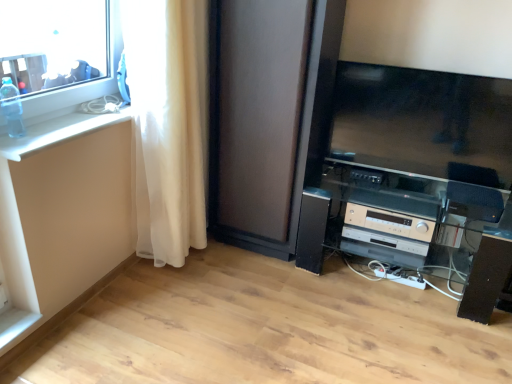
Where is `matte black screen door at center`? The image size is (512, 384). matte black screen door at center is located at coordinates (256, 118).

What do you see at coordinates (389, 228) in the screenshot?
I see `beige plastic stereo at lower right` at bounding box center [389, 228].

Describe the element at coordinates (396, 217) in the screenshot. Image resolution: width=512 pixels, height=384 pixels. I see `satin black entertainment center at lower right` at that location.

Where is `transparent plastic bottle at upper left`? transparent plastic bottle at upper left is located at coordinates (12, 108).

From a real-world perspective, between white sheer curtain at left and satin black entertainment center at lower right, who is vertically lower?

In real-world perspective, satin black entertainment center at lower right is lower.

Between white sheer curtain at left and satin black entertainment center at lower right, which one is positioned behind?

satin black entertainment center at lower right is more distant.

Are white sheer curtain at left and satin black entertainment center at lower right making contact?

No, white sheer curtain at left is not making contact with satin black entertainment center at lower right.

From the picture: Can satin black entertainment center at lower right be found inside white sheer curtain at left?

No, white sheer curtain at left does not contain satin black entertainment center at lower right.

From the image's perspective, which is above, beige plastic stereo at lower right or white glossy counter top at left?

white glossy counter top at left is shown above in the image.

Is white glossy counter top at left a part of beige plastic stereo at lower right?

That's incorrect, white glossy counter top at left is not inside beige plastic stereo at lower right.

Considering the positions of objects beige plastic stereo at lower right and white glossy counter top at left in the image provided, who is more to the right, beige plastic stereo at lower right or white glossy counter top at left?

Positioned to the right is beige plastic stereo at lower right.

Is beige plastic stereo at lower right shorter than white glossy counter top at left?

No, beige plastic stereo at lower right is not shorter than white glossy counter top at left.

Considering the sizes of white sheer curtain at left and matte black screen door at center in the image, is white sheer curtain at left bigger or smaller than matte black screen door at center?

In the image, white sheer curtain at left appears to be smaller than matte black screen door at center.

Locate an element on the screen. curtain in front of the matte black screen door at center is located at coordinates (166, 126).

In the scene shown: Is there a large distance between white sheer curtain at left and matte black screen door at center?

No.

Could you tell me if white sheer curtain at left is facing matte black screen door at center?

No, white sheer curtain at left is not facing towards matte black screen door at center.

Is satin black entertainment center at lower right surrounding matte black screen door at center?

That's incorrect, matte black screen door at center is not inside satin black entertainment center at lower right.

From a real-world perspective, who is located higher, satin black entertainment center at lower right or matte black screen door at center?

matte black screen door at center.

Is point (404, 220) positioned before point (238, 19)?

No, (404, 220) is behind (238, 19).

How different are the orientations of satin black entertainment center at lower right and matte black screen door at center in degrees?

The angle between the facing direction of satin black entertainment center at lower right and the facing direction of matte black screen door at center is 1.26 degrees.

Which object is wider, white sheer curtain at left or white glossy counter top at left?

white sheer curtain at left.

Can you confirm if white sheer curtain at left is positioned to the right of white glossy counter top at left?

Yes.

From a real-world perspective, which is physically below, white sheer curtain at left or white glossy counter top at left?

In real-world perspective, white sheer curtain at left is lower.

Is white sheer curtain at left facing away from white glossy counter top at left?

white sheer curtain at left is not turned away from white glossy counter top at left.

Does matte black screen door at center appear on the right side of transparent plastic bottle at upper left?

Indeed, matte black screen door at center is positioned on the right side of transparent plastic bottle at upper left.

How many degrees apart are the facing directions of matte black screen door at center and transparent plastic bottle at upper left?

There is a 89.6-degree angle between the facing directions of matte black screen door at center and transparent plastic bottle at upper left.

Which is correct: matte black screen door at center is inside transparent plastic bottle at upper left, or outside of it?

matte black screen door at center is outside transparent plastic bottle at upper left.

Does point (268, 36) appear closer or farther from the camera than point (13, 122)?

Point (268, 36) is positioned farther from the camera compared to point (13, 122).

Consider the image. From the image's perspective, relative to transparent plastic bottle at upper left, is white sheer curtain at left above or below?

Based on their image positions, white sheer curtain at left is located beneath transparent plastic bottle at upper left.

Does white sheer curtain at left lie in front of transparent plastic bottle at upper left?

That is False.

Which is behind, point (182, 244) or point (5, 109)?

The point (182, 244) is farther.

From the picture: Is white sheer curtain at left to the left of transparent plastic bottle at upper left from the viewer's perspective?

No.

Find the location of a particular element. entertainment center located below the white sheer curtain at left (from the image's perspective) is located at coordinates (396, 217).

Identify the location of appliance directly beneath the white glossy counter top at left (from a real-world perspective). (389, 228).

Looking at the image, which one is located closer to beige plastic stereo at lower right, white sheer curtain at left or satin black entertainment center at lower right?

The object closer to beige plastic stereo at lower right is satin black entertainment center at lower right.

Which object lies nearer to the anchor point transparent glass window at upper left, beige plastic stereo at lower right or white glossy counter top at left?

Among the two, white glossy counter top at left is located nearer to transparent glass window at upper left.

Which object lies further to the anchor point transparent glass window at upper left, white sheer curtain at left or transparent plastic bottle at upper left?

white sheer curtain at left.

From the image, which object appears to be nearer to transparent glass window at upper left, white glossy counter top at left or matte black screen door at center?

Among the two, white glossy counter top at left is located nearer to transparent glass window at upper left.

Looking at the image, which one is located further to white sheer curtain at left, transparent glass window at upper left or beige plastic stereo at lower right?

beige plastic stereo at lower right is positioned further to the anchor white sheer curtain at left.

From the image, which object appears to be farther from beige plastic stereo at lower right, matte black screen door at center or white glossy counter top at left?

The object further to beige plastic stereo at lower right is white glossy counter top at left.

Which object lies nearer to the anchor point white sheer curtain at left, transparent glass window at upper left or transparent plastic bottle at upper left?

The object closer to white sheer curtain at left is transparent glass window at upper left.

Looking at the image, which one is located further to transparent glass window at upper left, white glossy counter top at left or white sheer curtain at left?

The object further to transparent glass window at upper left is white sheer curtain at left.

Where is `counter top between transparent plastic bottle at upper left and white sheer curtain at left`? This screenshot has width=512, height=384. counter top between transparent plastic bottle at upper left and white sheer curtain at left is located at coordinates (58, 132).

The image size is (512, 384). I want to click on curtain situated between transparent plastic bottle at upper left and beige plastic stereo at lower right from left to right, so click(x=166, y=126).

At what (x,y) coordinates should I click in order to perform the action: click on window between transparent plastic bottle at upper left and satin black entertainment center at lower right in the horizontal direction. Please return your answer as a coordinate pair (x, y). This screenshot has width=512, height=384. Looking at the image, I should click on (85, 83).

Identify the location of screen door located between transparent plastic bottle at upper left and beige plastic stereo at lower right in the left-right direction. The height and width of the screenshot is (384, 512). (256, 118).